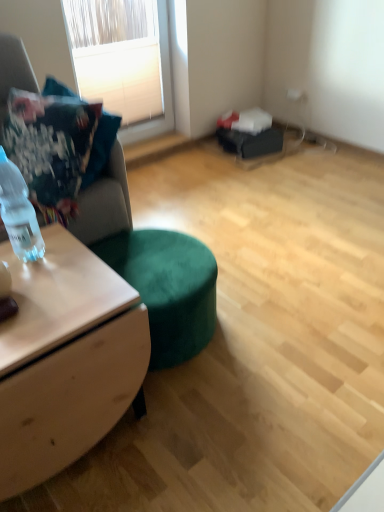
Question: Considering the relative sizes of white textured blinds at upper left and velvet cushion at left in the image provided, is white textured blinds at upper left smaller than velvet cushion at left?

Choices:
 (A) no
 (B) yes

Answer: (B)

Question: Is white textured blinds at upper left located outside velvet cushion at left?

Choices:
 (A) no
 (B) yes

Answer: (B)

Question: Considering the relative sizes of white textured blinds at upper left and velvet cushion at left in the image provided, is white textured blinds at upper left bigger than velvet cushion at left?

Choices:
 (A) no
 (B) yes

Answer: (A)

Question: From a real-world perspective, is white textured blinds at upper left below velvet cushion at left?

Choices:
 (A) no
 (B) yes

Answer: (B)

Question: Does white textured blinds at upper left appear on the left side of velvet cushion at left?

Choices:
 (A) yes
 (B) no

Answer: (B)

Question: From the image's perspective, does white textured blinds at upper left appear higher than velvet cushion at left?

Choices:
 (A) no
 (B) yes

Answer: (B)

Question: From the image's perspective, is suede fabric couch at left on top of white textured blinds at upper left?

Choices:
 (A) no
 (B) yes

Answer: (A)

Question: Can you confirm if suede fabric couch at left is taller than white textured blinds at upper left?

Choices:
 (A) yes
 (B) no

Answer: (A)

Question: Is suede fabric couch at left beside white textured blinds at upper left?

Choices:
 (A) yes
 (B) no

Answer: (B)

Question: Is suede fabric couch at left to the right of white textured blinds at upper left from the viewer's perspective?

Choices:
 (A) yes
 (B) no

Answer: (B)

Question: Can you confirm if suede fabric couch at left is positioned to the left of white textured blinds at upper left?

Choices:
 (A) no
 (B) yes

Answer: (B)

Question: Does suede fabric couch at left lie behind white textured blinds at upper left?

Choices:
 (A) yes
 (B) no

Answer: (B)

Question: Can suede fabric couch at left be found inside white textured blinds at upper left?

Choices:
 (A) yes
 (B) no

Answer: (B)